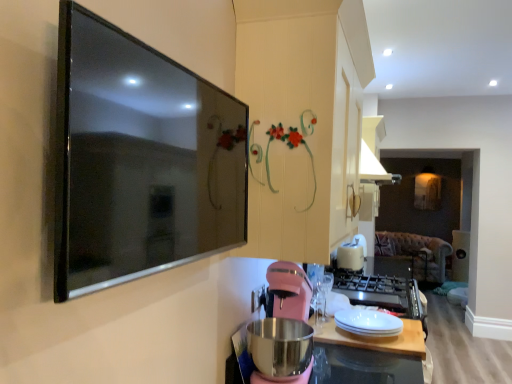
Question: Should I look upward or downward to see black glossy tv at upper left?

Choices:
 (A) down
 (B) up

Answer: (B)

Question: Considering the relative sizes of white matte wood at center and white plastic toaster at upper center in the image provided, is white matte wood at center smaller than white plastic toaster at upper center?

Choices:
 (A) no
 (B) yes

Answer: (B)

Question: Is the depth of white matte wood at center less than that of white plastic toaster at upper center?

Choices:
 (A) no
 (B) yes

Answer: (B)

Question: Does white matte wood at center come behind white plastic toaster at upper center?

Choices:
 (A) yes
 (B) no

Answer: (B)

Question: Considering the relative sizes of white matte wood at center and white plastic toaster at upper center in the image provided, is white matte wood at center bigger than white plastic toaster at upper center?

Choices:
 (A) yes
 (B) no

Answer: (B)

Question: From a real-world perspective, is white matte wood at center over white plastic toaster at upper center?

Choices:
 (A) yes
 (B) no

Answer: (B)

Question: Is white matte wood at center located outside white plastic toaster at upper center?

Choices:
 (A) no
 (B) yes

Answer: (B)

Question: From the image's perspective, is white glossy plate at center below black glossy tv at upper left?

Choices:
 (A) yes
 (B) no

Answer: (A)

Question: Is white glossy plate at center wider than black glossy tv at upper left?

Choices:
 (A) yes
 (B) no

Answer: (A)

Question: Is white glossy plate at center bigger than black glossy tv at upper left?

Choices:
 (A) yes
 (B) no

Answer: (B)

Question: Is white glossy plate at center not close to black glossy tv at upper left?

Choices:
 (A) no
 (B) yes

Answer: (B)

Question: Is white glossy plate at center at the left side of black glossy tv at upper left?

Choices:
 (A) no
 (B) yes

Answer: (A)

Question: Is white glossy plate at center completely or partially outside of black glossy tv at upper left?

Choices:
 (A) no
 (B) yes

Answer: (B)

Question: Considering the relative sizes of pink matte blender at lower center and black glossy tv at upper left in the image provided, is pink matte blender at lower center bigger than black glossy tv at upper left?

Choices:
 (A) yes
 (B) no

Answer: (A)